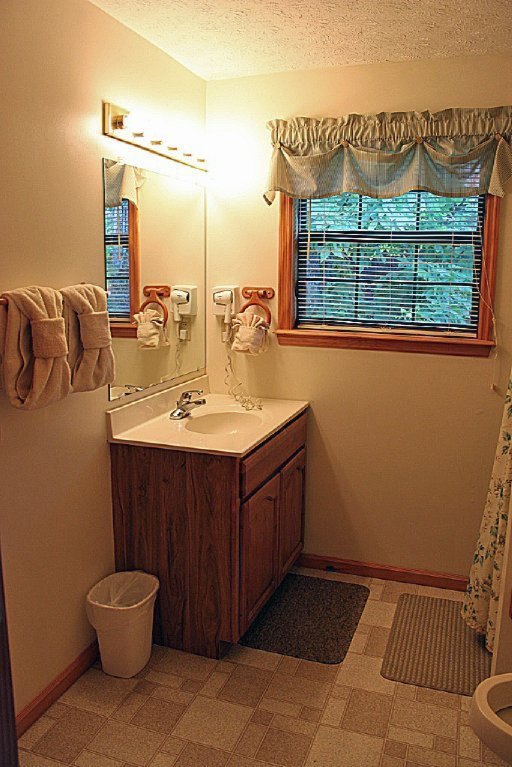
Locate an element on the screen. The height and width of the screenshot is (767, 512). counter top is located at coordinates (217, 436).